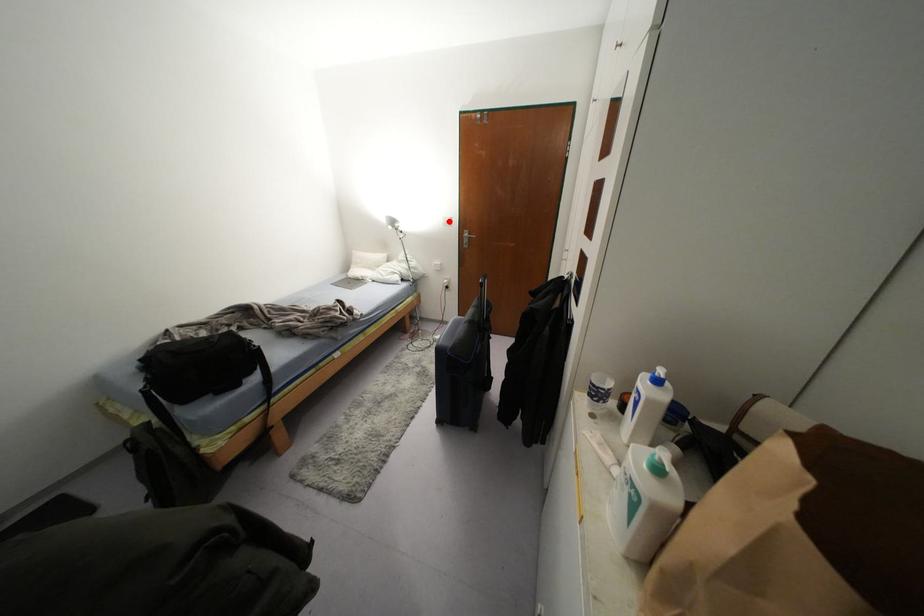
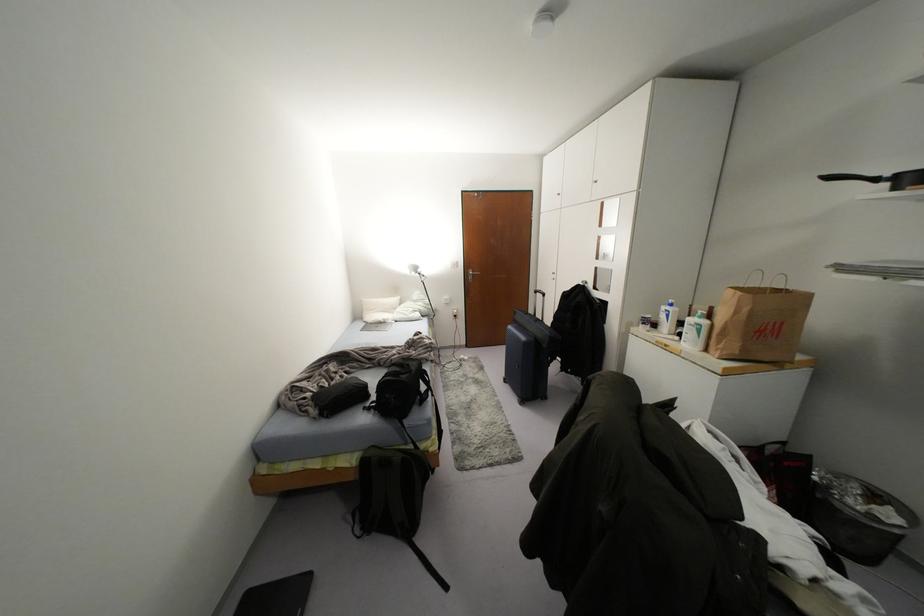
Locate, in the second image, the point that corresponds to the highlighted location in the first image.

(456, 264)